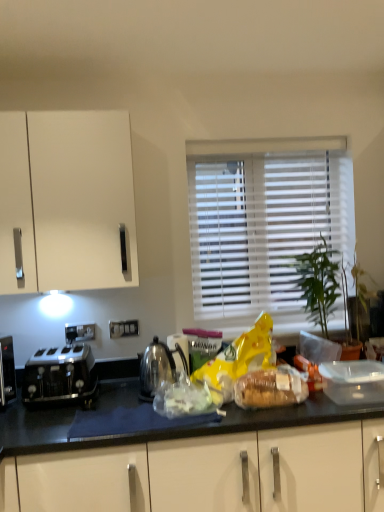
Question: From the image's perspective, is translucent plastic bread at center, marked as the first food in a right-to-left arrangement, above or below white blinds at center?

Choices:
 (A) above
 (B) below

Answer: (B)

Question: Is translucent plastic bread at center, marked as the first food in a right-to-left arrangement, situated inside white blinds at center or outside?

Choices:
 (A) inside
 (B) outside

Answer: (B)

Question: Estimate the real-world distances between objects in this image. Which object is farther from the translucent plastic bread at center, which appears as the 2th food when viewed from the left?

Choices:
 (A) translucent plastic bag at center, the 2th food from the right
 (B) satin black toaster at left
 (C) polished metallic kettle at center
 (D) white blinds at center

Answer: (D)

Question: Which object is the closest to the translucent plastic bag at center, the 2th food from the right?

Choices:
 (A) polished metallic kettle at center
 (B) satin black toaster at left
 (C) white blinds at center
 (D) translucent plastic bread at center, which appears as the 2th food when viewed from the left

Answer: (A)